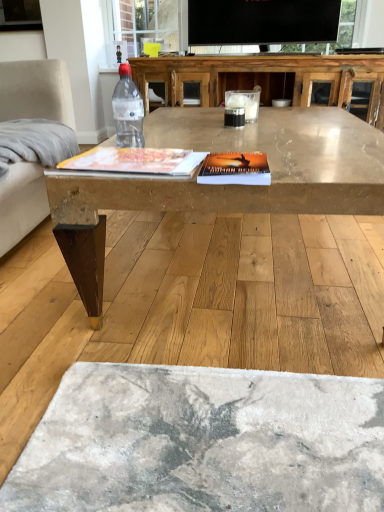
Image resolution: width=384 pixels, height=512 pixels. In order to click on free space to the back side of transparent plastic bottle at center in this screenshot , I will do [x=141, y=140].